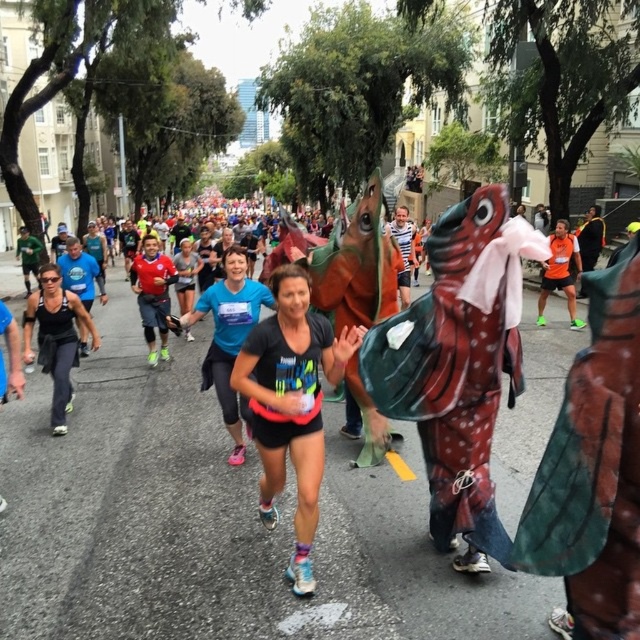
In the marathon scene, there is a blue fabric shirt at center and a person in a dinosaur costume. Which object is closer to the point marked at coordinates (228, 337)?

The blue fabric shirt at center is located at point (228, 337), so it is exactly at that coordinate. The person in the dinosaur costume is not mentioned in the objects description, so we cannot determine their position relative to the point.

You are standing at the point labeled as point (x=289, y=394) and want to walk towards the finish line located directly ahead. However, there is a marathon participant in a dinosaur costume running towards you. If the distance between you and the viewer is 3.69 meters, can you safely step aside to avoid a collision without leaving the 2.5 meter wide running lane?

The distance between you and the viewer is 3.69 meters. Since the running lane is 2.5 meters wide, you have enough space to step aside safely within the lane to avoid the collision.